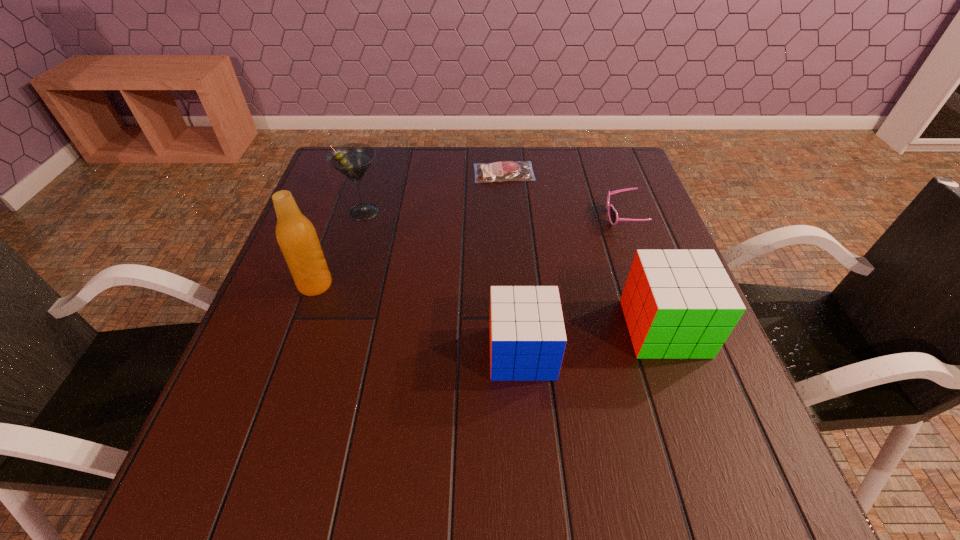
Given the evenly spaced cubes in the image, where should an extra cube be added on the left to preserve the spacing? Please point to a vacant space. Please provide its 2D coordinates. Your answer should be formatted as a tuple, i.e. [(x, y)], where the tuple contains the x and y coordinates of a point satisfying the conditions above.

[(366, 380)]